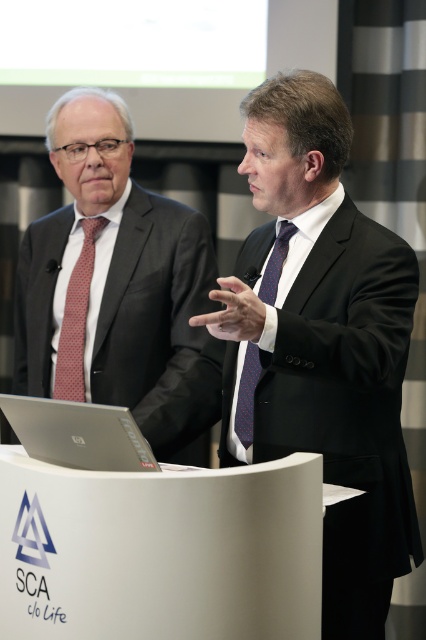
You are an event organizer who needs to adjust the camera angle to ensure both the silver metallic laptop at lower left and the blue silk tie at center are clearly visible. Based on their positions, which object should you move the camera closer to in order to capture both in the frame?

The silver metallic laptop at lower left is in front of the blue silk tie at center, so to capture both in the frame, you should move the camera closer to the silver metallic laptop at lower left to ensure the blue silk tie at center remains visible behind it.

You are a photographer setting up for a group photo. You need to position two subjects wearing matte black suits so they are exactly 24 inches apart. Given the current positions of the matte black suit at center and the matte black suit at left, do they meet the required distance?

The distance between the matte black suit at center and the matte black suit at left is 23.85 inches, which is just slightly less than the required 24 inches. They are almost there but need to move about 0.15 inches farther apart to meet the exact requirement.